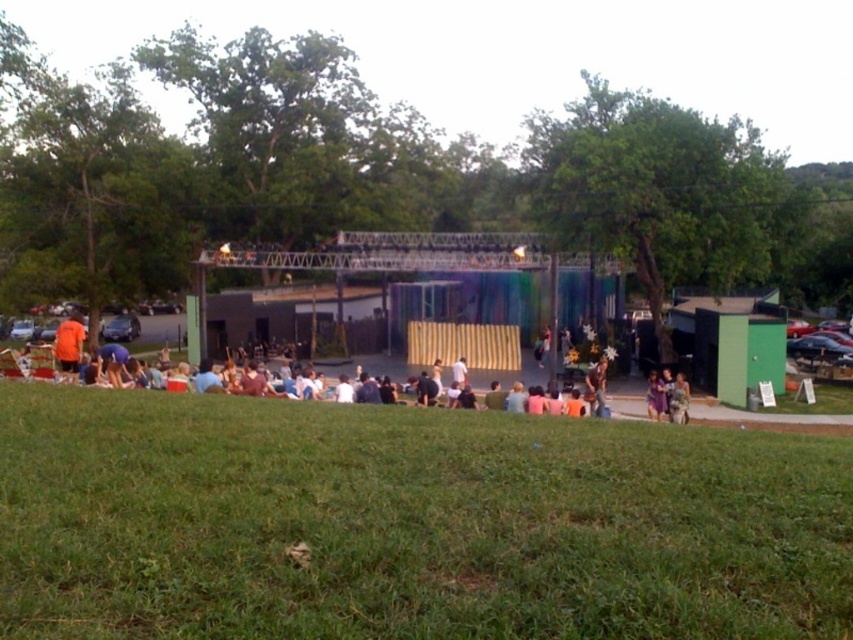
You are an event planner looking at the image of the outdoor event. You notice the wooden stage at center and the light brown fabric dress at center. Based on their positions, which object is closer to the left side of the image?

The wooden stage at center is to the left of the light brown fabric dress at center, so the wooden stage at center is closer to the left side of the image.

Looking at this image, you are a performer preparing to walk from the back of the stage to the front. You see the green grassy field at lower center and the wooden stage at center. Which object will you encounter first as you move forward?

You will encounter the wooden stage at center first because the green grassy field at lower center is in front of it, meaning the stage is closer to you as you move forward from the back.

You are a photographer positioned at the edge of the grassy area where the audience is seated. You want to capture a photo of the light brown fabric dress at center while also including the wooden stage at center in the background. Given that your camera has a maximum focus range of 15 meters, will you be able to get both subjects in focus at the same time?

The wooden stage at center and light brown fabric dress at center are 16.42 meters apart from each other. Since the camera can only focus up to 15 meters, the distance between them exceeds the focus range. Therefore, you cannot get both subjects in focus simultaneously.